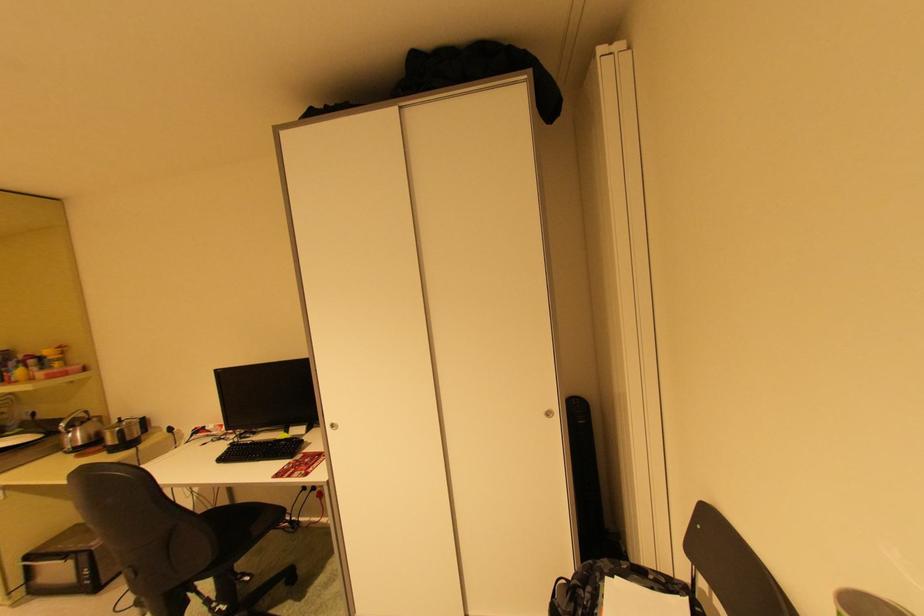
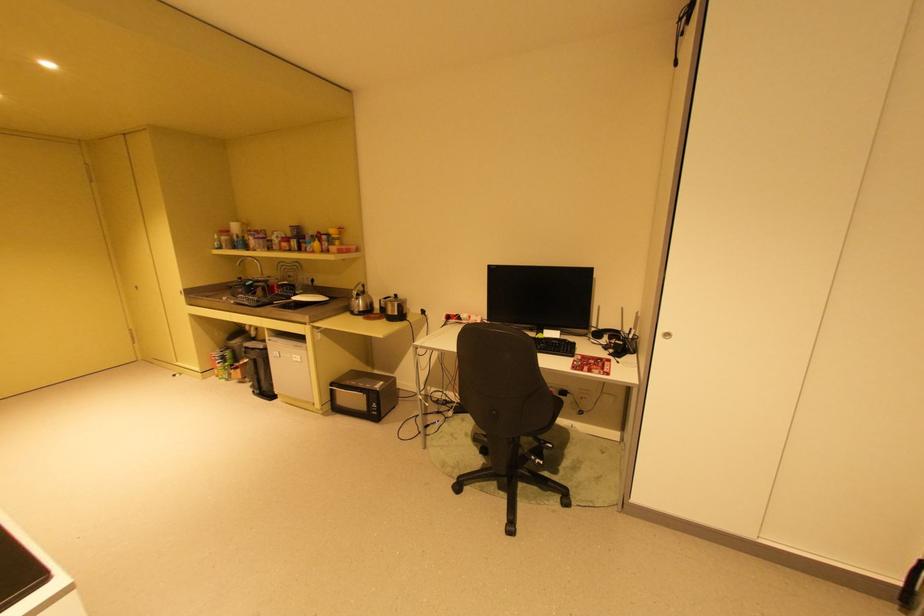
In the second image, find the point that corresponds to (x=127, y=442) in the first image.

(404, 314)